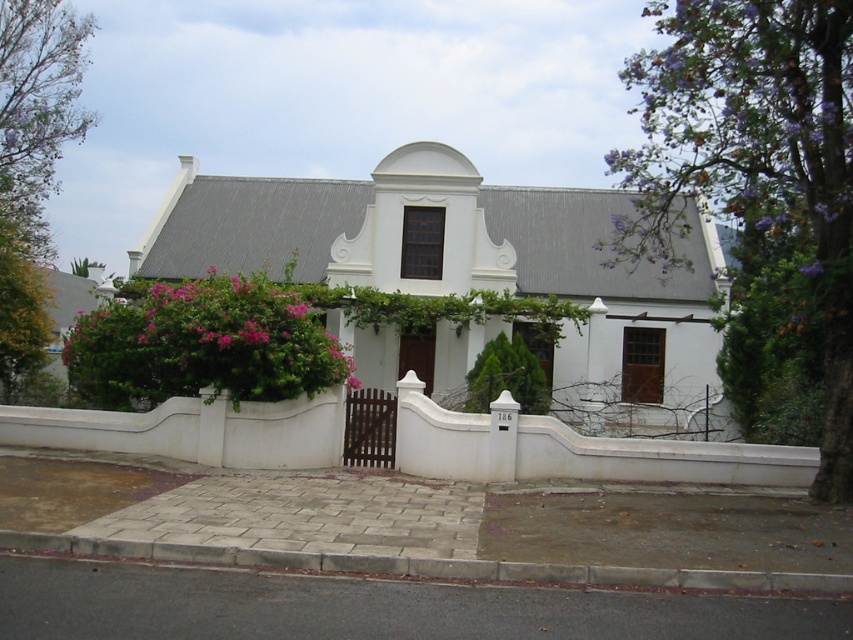
You are a landscape architect planning to install a new sprinkler system. The sprinkler has a maximum range of 50 feet. Based on the scene, will the purple leafy tree at upper right and the pink matte flowers at center both be watered by a single sprinkler placed at the center?

The purple leafy tree at upper right is 49.56 feet from the pink matte flowers at center. Since the distance is less than the sprinkler range of 50 feet, placing the sprinkler at the center would water both the purple leafy tree at upper right and the pink matte flowers at center.

You are a visitor arriving at the white smooth house at center and pink matte flowers at center. You want to approach the house from the flowers. Which direction should you move relative to the flowers?

The white smooth house at center is positioned on the right side of the pink matte flowers at center, so to approach the house from the flowers, you should move to the right relative to the flowers.